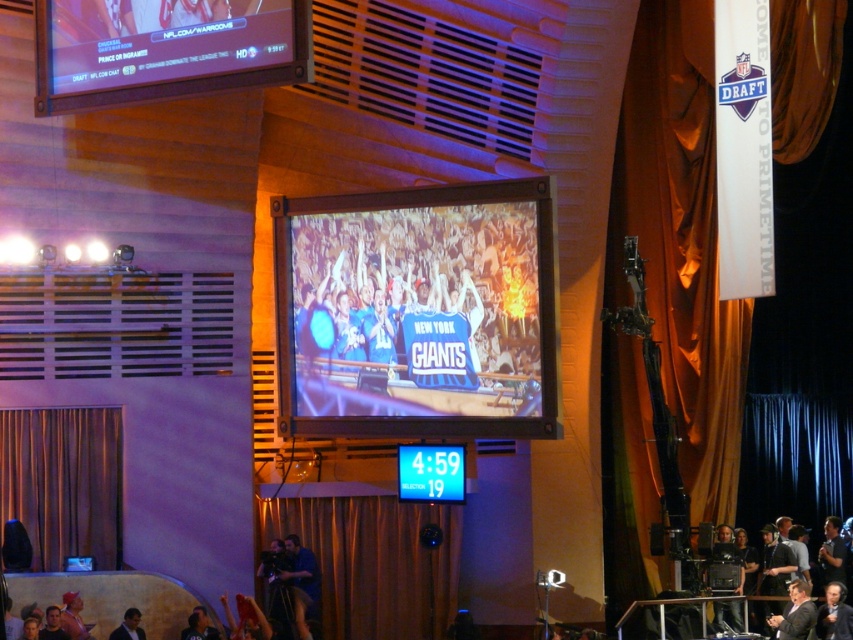
Can you confirm if matte black screen at upper left is smaller than dark gray suit at lower center?

Correct, matte black screen at upper left occupies less space than dark gray suit at lower center.

Between point (109, 58) and point (140, 637), which one is positioned in front?

Positioned in front is point (109, 58).

Where is `matte black screen at upper left`? matte black screen at upper left is located at coordinates (164, 49).

Which of these two, dark gray suit at lower right or dark gray suit at lower center, stands taller?

Standing taller between the two is dark gray suit at lower right.

Measure the distance between dark gray suit at lower right and camera.

dark gray suit at lower right and camera are 34.72 meters apart.

Is point (830, 589) farther from camera compared to point (115, 627)?

Yes.

This screenshot has width=853, height=640. Identify the location of dark gray suit at lower right. (813, 612).

Which of these two, matte black tv at center or matte black screen at upper left, stands shorter?

With less height is matte black screen at upper left.

Can you confirm if matte black tv at center is taller than matte black screen at upper left?

Correct, matte black tv at center is much taller as matte black screen at upper left.

Does point (384, 320) come closer to viewer compared to point (51, 56)?

No, (384, 320) is further to viewer.

This screenshot has height=640, width=853. I want to click on matte black tv at center, so click(418, 310).